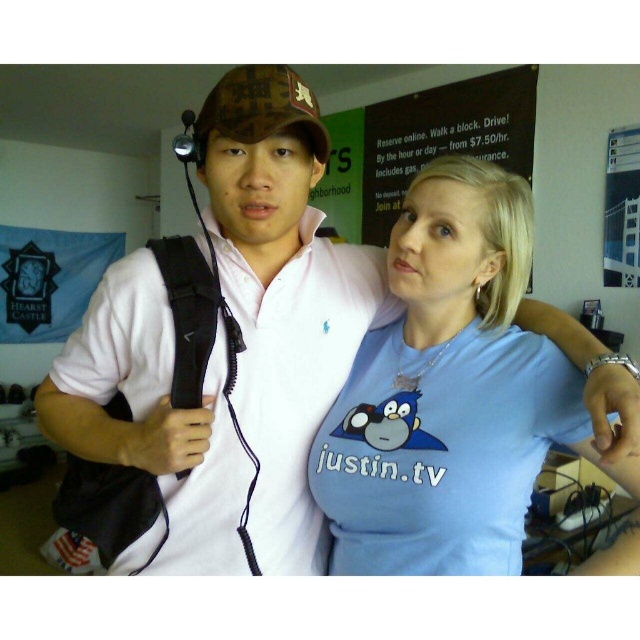
Question: Among these points, which one is nearest to the camera?

Choices:
 (A) [x=312, y=113]
 (B) [x=465, y=564]
 (C) [x=410, y=161]

Answer: (A)

Question: In this image, where is black matte signboard at upper center located relative to camouflage fabric baseball cap at upper center?

Choices:
 (A) left
 (B) right

Answer: (B)

Question: Among these objects, which one is nearest to the camera?

Choices:
 (A) camouflage fabric baseball cap at upper center
 (B) black matte signboard at upper center

Answer: (A)

Question: Which object is the closest to the black matte signboard at upper center?

Choices:
 (A) blue cotton t-shirt at center
 (B) camouflage fabric baseball cap at upper center

Answer: (A)

Question: Does blue cotton t-shirt at center have a greater width compared to black matte signboard at upper center?

Choices:
 (A) no
 (B) yes

Answer: (A)

Question: Does blue cotton t-shirt at center have a smaller size compared to camouflage fabric baseball cap at upper center?

Choices:
 (A) yes
 (B) no

Answer: (B)